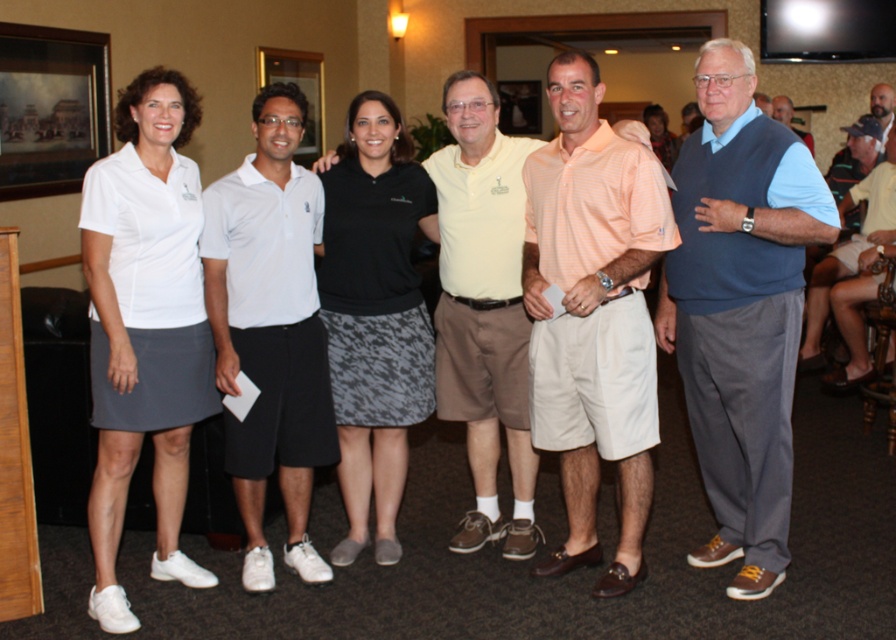
Question: Does light yellow polo shirt at center appear on the left side of matte black skirt at center?

Choices:
 (A) no
 (B) yes

Answer: (B)

Question: Which point is farther from the camera taking this photo?

Choices:
 (A) (121, 317)
 (B) (543, 417)

Answer: (B)

Question: Which object is positioned farthest from the blue sweater at right?

Choices:
 (A) black textured skirt at center
 (B) orange striped polo shirt at center

Answer: (A)

Question: Among these points, which one is nearest to the camera?

Choices:
 (A) (673, 150)
 (B) (576, 96)
 (C) (448, 262)

Answer: (B)

Question: Can you confirm if white matte skirt at left is positioned to the left of blue sweater at center?

Choices:
 (A) no
 (B) yes

Answer: (B)

Question: Where is blue sweater at right located in relation to gray wool sweater at center in the image?

Choices:
 (A) left
 (B) right

Answer: (A)